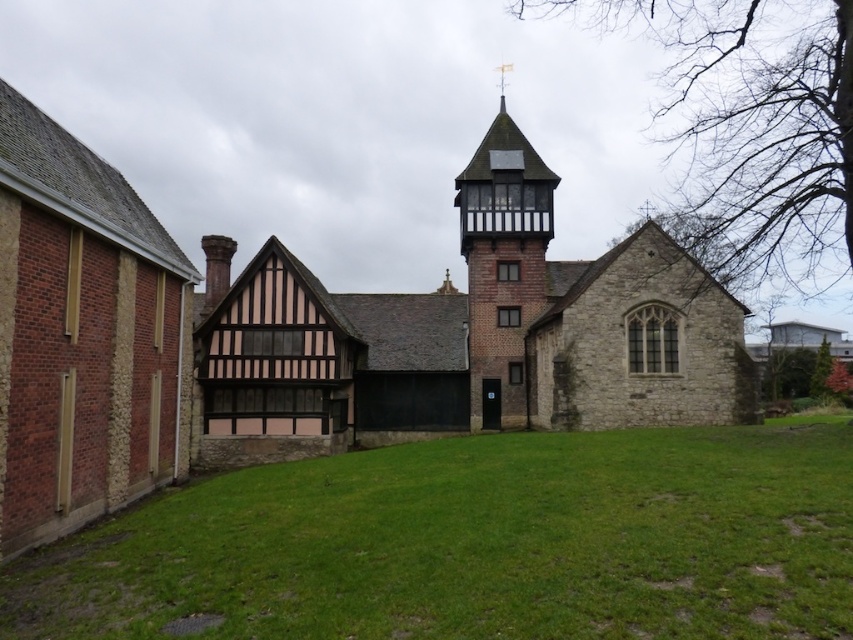
Is green grass at center taller than brick stonework bell tower at center?

In fact, green grass at center may be shorter than brick stonework bell tower at center.

Does green grass at center have a larger size compared to brick stonework bell tower at center?

No, green grass at center is not bigger than brick stonework bell tower at center.

Find the location of a particular element. The width and height of the screenshot is (853, 640). green grass at center is located at coordinates (474, 545).

Does stone church at center have a greater width compared to brick stonework bell tower at center?

Yes, stone church at center is wider than brick stonework bell tower at center.

Does stone church at center appear under brick stonework bell tower at center?

Correct, stone church at center is located below brick stonework bell tower at center.

Image resolution: width=853 pixels, height=640 pixels. Find the location of `stone church at center`. stone church at center is located at coordinates (321, 336).

Image resolution: width=853 pixels, height=640 pixels. I want to click on stone church at center, so click(x=321, y=336).

Between stone church at center and green grass at center, which one has more height?

Standing taller between the two is stone church at center.

Can you confirm if stone church at center is positioned to the right of green grass at center?

Incorrect, stone church at center is not on the right side of green grass at center.

Does point (550, 381) lie in front of point (579, 612)?

No, it is not.

In order to click on stone church at center in this screenshot , I will do `click(321, 336)`.